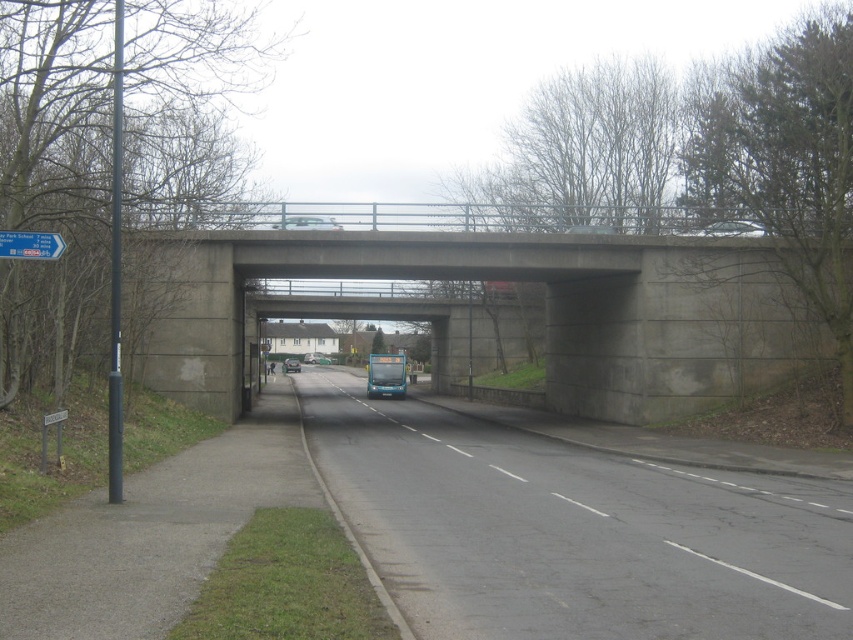
You are driving a metallic silver car at center and need to pass under a concrete bridge. The teal glossy bus at center is parked ahead on the road. Can your car safely pass under the bridge without hitting the bridge structure?

The teal glossy bus at center is much taller as metallic silver car at center. Since the bus is taller, it might indicate that the bridge clearance is sufficient for the car to pass safely, but there is a risk if the bridge has low clearance. However, without knowing the exact height of the bridge, it is uncertain. Please check the bridge height signs or measure the clearance before proceeding.

You are a pedestrian standing at the side of the road. You see a teal glossy bus at center and a metallic silver car at center. Which vehicle is closer to you?

The teal glossy bus at center is located above the metallic silver car at center, so the metallic silver car at center is closer to you.